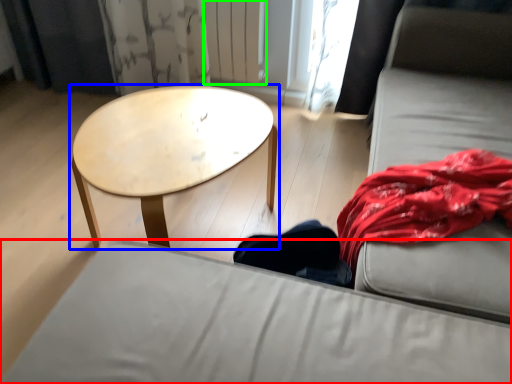
Question: Considering the real-world distances, which object is farthest from studio couch (highlighted by a red box)? coffee table (highlighted by a blue box) or radiator (highlighted by a green box)?

Choices:
 (A) coffee table
 (B) radiator

Answer: (B)